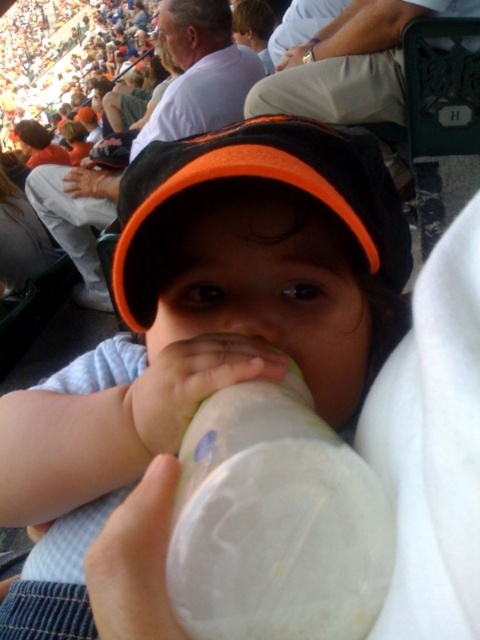
You are a photographer at a stadium event. You need to capture a close shot of the transparent plastic bottle at center and the black fabric cap at center. Which object is narrower in width?

The transparent plastic bottle at center has a lesser width compared to the black fabric cap at center, so the transparent plastic bottle at center is narrower.

You are a photographer at a stadium event. You see the white plastic bottle at center and the black fabric cap at center in your camera frame. Which object is closer to the camera lens?

The white plastic bottle at center is positioned under the black fabric cap at center, meaning it is closer to the camera lens since it is below and in front of the cap.

In the image, there is a point labeled at coordinates (204, 326). Which object in the scene does this point correspond to?

The point at coordinates (204, 326) corresponds to the white plastic bottle at center.